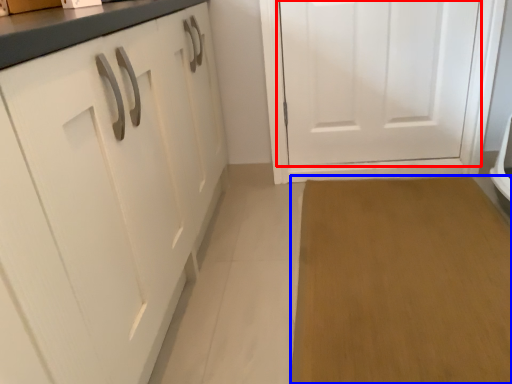
Question: Among these objects, which one is nearest to the camera, door (highlighted by a red box) or plain (highlighted by a blue box)?

Choices:
 (A) door
 (B) plain

Answer: (B)